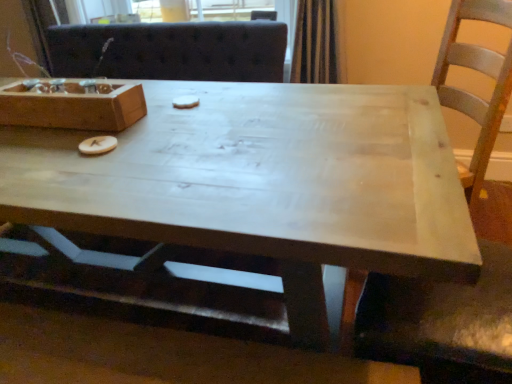
Find the location of a particular element. This screenshot has height=384, width=512. vacant area that is situated to the right of wooden box at upper left is located at coordinates (173, 117).